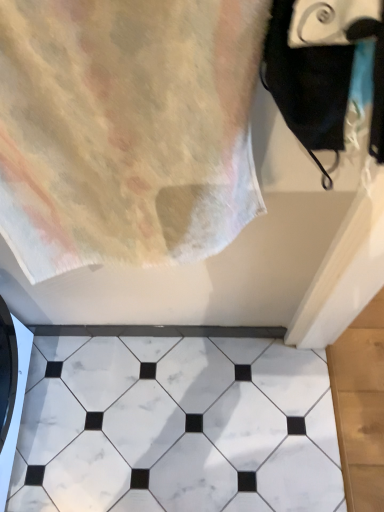
Question: Is white marble tile at center outside pastel cotton towel at upper left?

Choices:
 (A) yes
 (B) no

Answer: (A)

Question: Considering the relative positions of white marble tile at center and pastel cotton towel at upper left in the image provided, is white marble tile at center to the right of pastel cotton towel at upper left from the viewer's perspective?

Choices:
 (A) yes
 (B) no

Answer: (A)

Question: From a real-world perspective, is white marble tile at center on pastel cotton towel at upper left?

Choices:
 (A) no
 (B) yes

Answer: (A)

Question: Can you confirm if white marble tile at center is smaller than pastel cotton towel at upper left?

Choices:
 (A) yes
 (B) no

Answer: (A)

Question: Does white marble tile at center appear on the left side of pastel cotton towel at upper left?

Choices:
 (A) yes
 (B) no

Answer: (B)

Question: From the image's perspective, is pastel cotton towel at upper left positioned above or below white marble tile at center?

Choices:
 (A) above
 (B) below

Answer: (A)

Question: Is point (198, 81) positioned closer to the camera than point (286, 471)?

Choices:
 (A) closer
 (B) farther

Answer: (A)

Question: Considering the relative positions of pastel cotton towel at upper left and white marble tile at center in the image provided, is pastel cotton towel at upper left to the left or to the right of white marble tile at center?

Choices:
 (A) right
 (B) left

Answer: (B)

Question: Is pastel cotton towel at upper left spatially inside white marble tile at center, or outside of it?

Choices:
 (A) inside
 (B) outside

Answer: (B)

Question: Does point (198, 432) appear closer or farther from the camera than point (104, 131)?

Choices:
 (A) farther
 (B) closer

Answer: (A)

Question: Is white marble tile at center spatially inside pastel cotton towel at upper left, or outside of it?

Choices:
 (A) outside
 (B) inside

Answer: (A)

Question: In the image, is white marble tile at center positioned in front of or behind pastel cotton towel at upper left?

Choices:
 (A) front
 (B) behind

Answer: (B)

Question: Based on their sizes in the image, would you say white marble tile at center is bigger or smaller than pastel cotton towel at upper left?

Choices:
 (A) small
 (B) big

Answer: (A)

Question: In the image, is black matte towel at upper right positioned in front of or behind white marble tile at center?

Choices:
 (A) behind
 (B) front

Answer: (B)

Question: Looking at their shapes, would you say black matte towel at upper right is wider or thinner than white marble tile at center?

Choices:
 (A) thin
 (B) wide

Answer: (A)